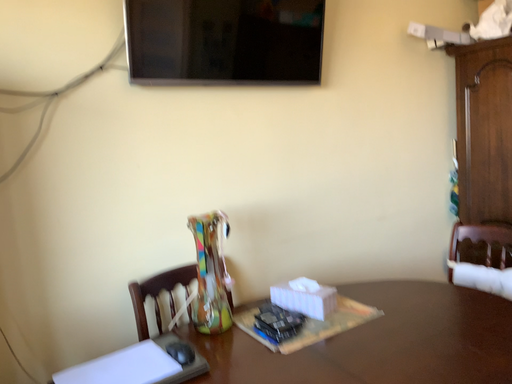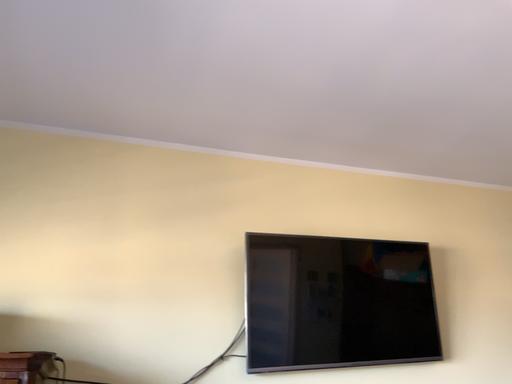
Question: How did the camera likely rotate when shooting the video?

Choices:
 (A) rotated upward
 (B) rotated downward

Answer: (A)